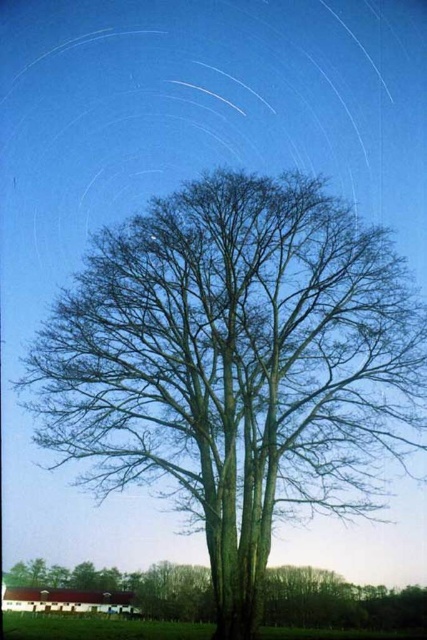
You are standing at the center of the image and want to locate the brown textured tree at center. What are the coordinates of its position?

The brown textured tree at center is located at coordinates point (236,365).

You are a bird looking for a place to perch. You can see the brown textured tree at center and the green matte tree at center. Which tree is closer to you?

The brown textured tree at center is 43.63 feet away from the green matte tree at center. Since you are a bird looking for a place to perch, you are likely positioned between them, so whichever is closer would depend on your exact location. However, the description only provides the distance between the two trees, not their positions relative to the observer. Therefore, we cannot determine which is closer to you based solely on the given information.